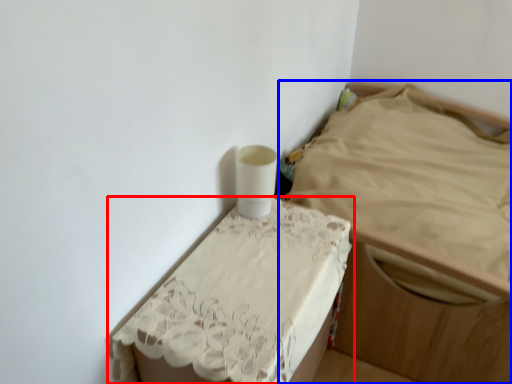
Question: Which object is closer to the camera taking this photo, furniture (highlighted by a red box) or furniture (highlighted by a blue box)?

Choices:
 (A) furniture
 (B) furniture

Answer: (A)